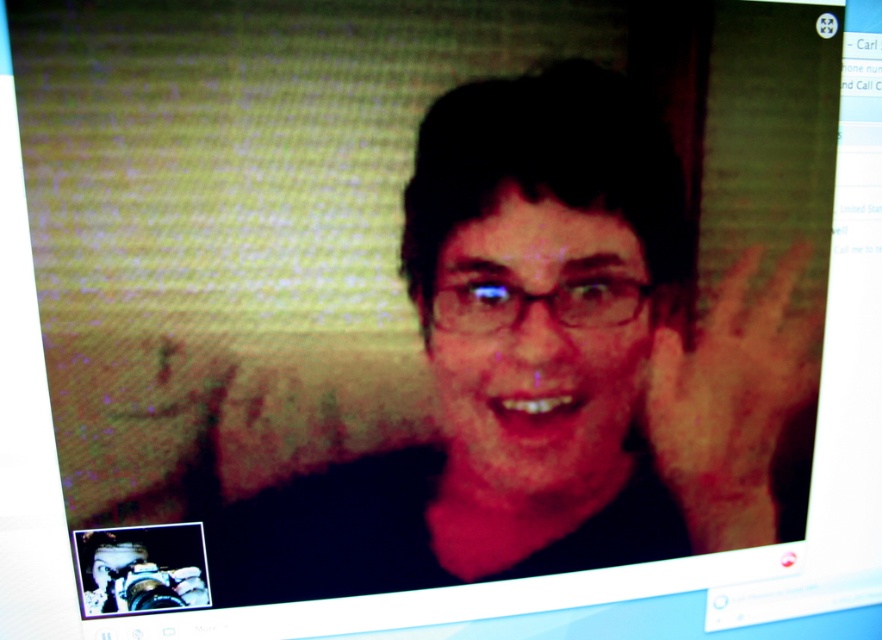
Who is lower down, matte black face at center or brown skin at right?

brown skin at right is lower down.

Which is in front, point (488, 376) or point (659, 340)?

Point (488, 376) is more forward.

This screenshot has height=640, width=882. What are the coordinates of `matte black face at center` in the screenshot? It's located at coord(537,346).

Identify the location of matte black face at center. (537, 346).